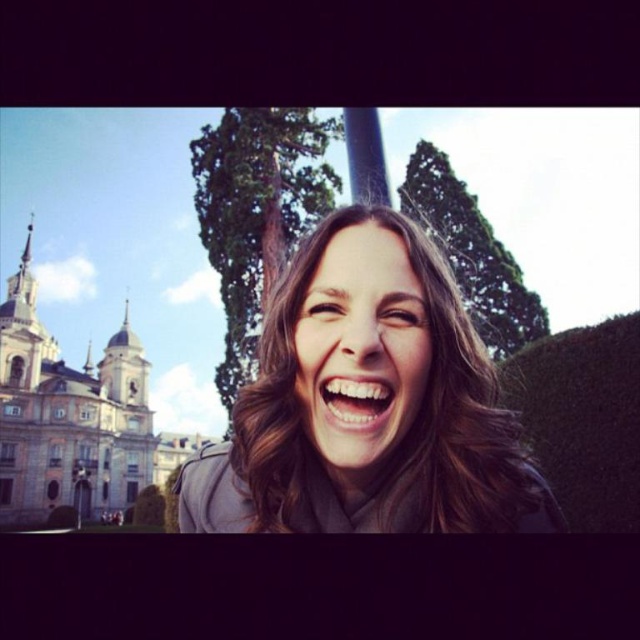
Question: Which of the following is the farthest from the observer?

Choices:
 (A) brown matte hair at center
 (B) white glossy teeth at center

Answer: (B)

Question: Which of the following is the closest to the observer?

Choices:
 (A) matte brown hair at center
 (B) white glossy teeth at center
 (C) brown matte hair at center

Answer: (C)

Question: Does matte brown hair at center appear under white glossy teeth at center?

Choices:
 (A) yes
 (B) no

Answer: (B)

Question: Does matte brown hair at center come behind white glossy teeth at center?

Choices:
 (A) no
 (B) yes

Answer: (A)

Question: Is brown matte hair at center above white glossy teeth at center?

Choices:
 (A) yes
 (B) no

Answer: (B)

Question: Based on their relative distances, which object is farther from the matte brown hair at center?

Choices:
 (A) brown matte hair at center
 (B) white glossy teeth at center

Answer: (B)